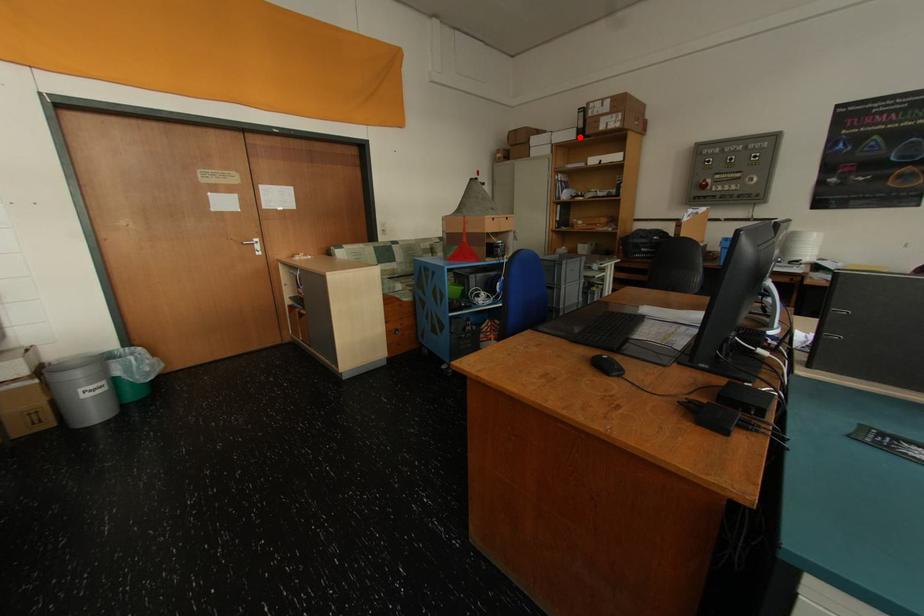
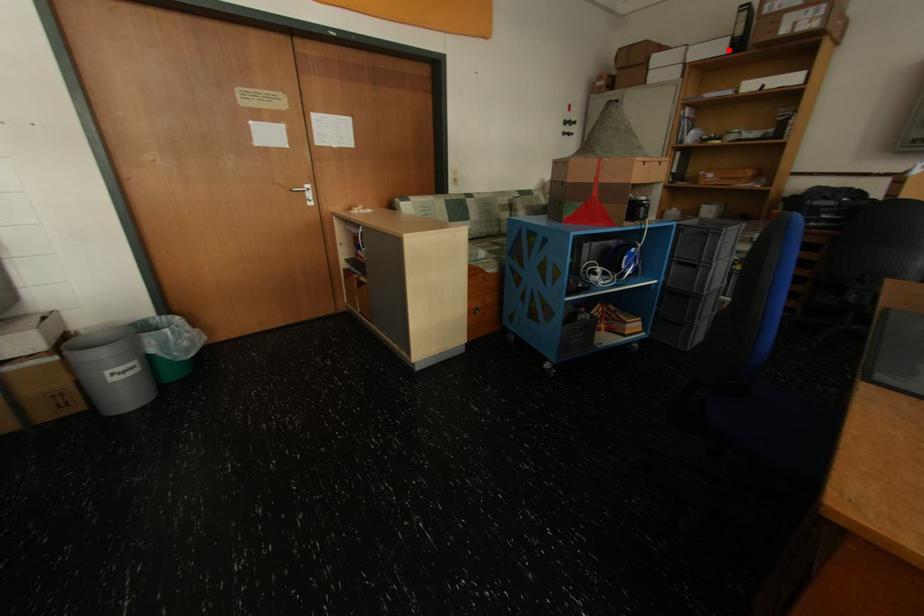
I am providing you with two images of the same scene from different viewpoints. A red point is marked on the first image and another point is marked on the second image. Is the red point in image1 aligned with the point shown in image2?

Yes